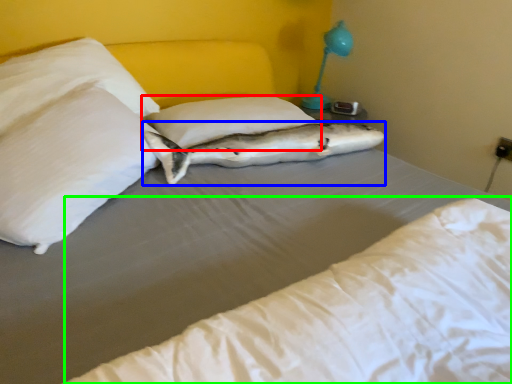
Question: Based on their relative distances, which object is farther from pillow (highlighted by a red box)? Choose from fish (highlighted by a blue box) and mattress (highlighted by a green box).

Choices:
 (A) fish
 (B) mattress

Answer: (B)